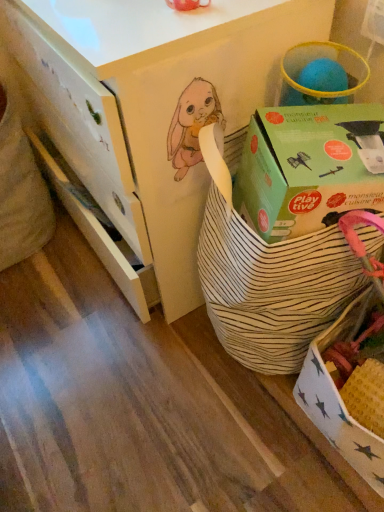
Question: From a real-world perspective, is green cardboard box at upper right positioned above or below white striped fabric basket at center?

Choices:
 (A) above
 (B) below

Answer: (A)

Question: From the image's perspective, relative to white striped fabric basket at center, is green cardboard box at upper right above or below?

Choices:
 (A) above
 (B) below

Answer: (A)

Question: Which of these objects is positioned farthest from the white striped fabric basket at center?

Choices:
 (A) white striped basket at center
 (B) green cardboard box at upper right

Answer: (A)

Question: Considering the real-world distances, which object is farthest from the white striped basket at center?

Choices:
 (A) green cardboard box at upper right
 (B) white striped fabric basket at center

Answer: (A)